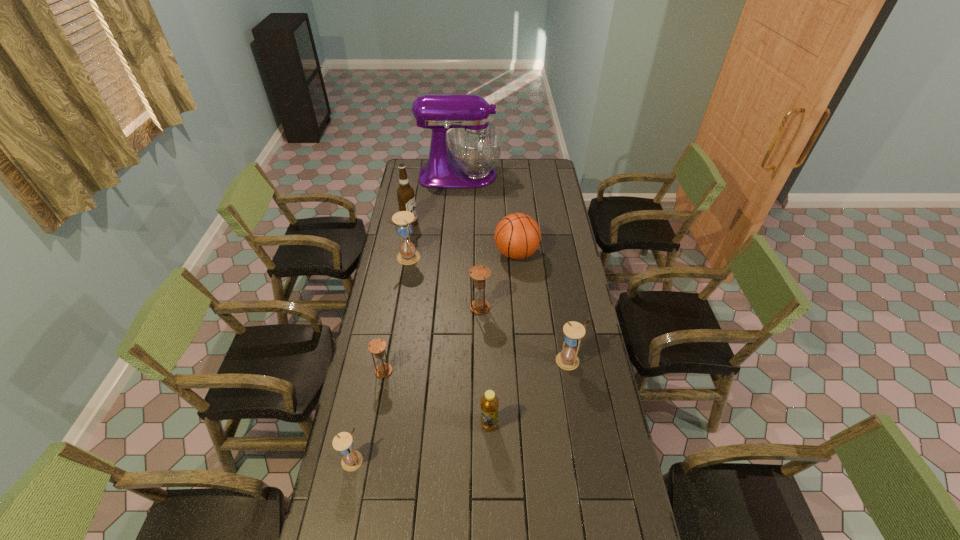
The height and width of the screenshot is (540, 960). In the image, there is a desktop. Identify the location of vacant space at the left edge. (359, 428).

In the image, there is a desktop. At what (x,y) coordinates should I click in order to perform the action: click on free space at the right edge. Please return your answer as a coordinate pair (x, y). The width and height of the screenshot is (960, 540). Looking at the image, I should click on (573, 401).

Where is `free point at the far right corner`? Image resolution: width=960 pixels, height=540 pixels. free point at the far right corner is located at coordinates (554, 161).

This screenshot has width=960, height=540. In order to click on vacant area between the right brown hourglass and the purple mixer in this screenshot , I will do `click(470, 241)`.

The width and height of the screenshot is (960, 540). In order to click on free space between the alcohol and the second nearest object in this screenshot , I will do `click(449, 324)`.

This screenshot has width=960, height=540. Find the location of `free space that is in between the basketball and the second farthest object`. free space that is in between the basketball and the second farthest object is located at coordinates (463, 239).

This screenshot has width=960, height=540. Find the location of `vacant point located between the bottle and the nearest object`. vacant point located between the bottle and the nearest object is located at coordinates (420, 442).

The width and height of the screenshot is (960, 540). Identify the location of free space between the farthest object and the second farthest object. (435, 199).

At what (x,y) coordinates should I click in order to perform the action: click on free spot between the rightmost object and the second farthest hourglass. Please return your answer as a coordinate pair (x, y). The image size is (960, 540). Looking at the image, I should click on (524, 334).

You are a GUI agent. You are given a task and a screenshot of the screen. Output one action in this format:
    pyautogui.click(x=<x>, y=<y>)
    Task: Click on the vacant area between the smallest white hourglass and the rightmost hourglass
    
    Given the screenshot: What is the action you would take?
    pyautogui.click(x=461, y=410)